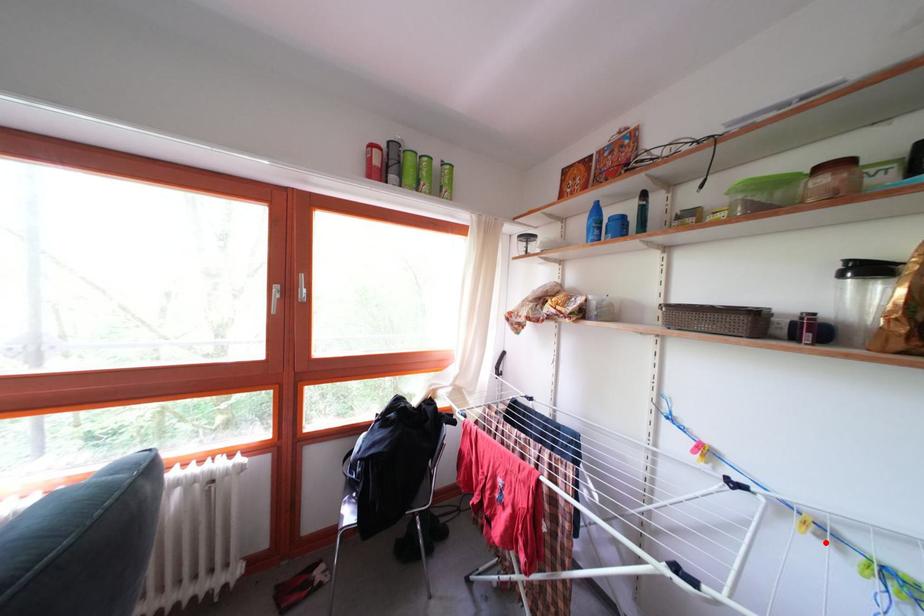
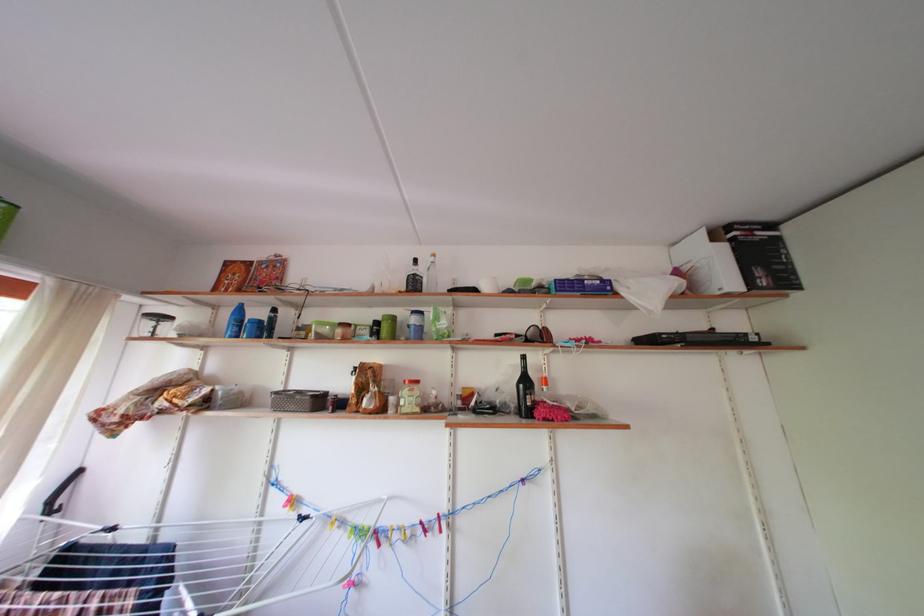
The point at the highlighted location is marked in the first image. Where is the corresponding point in the second image?

(346, 535)